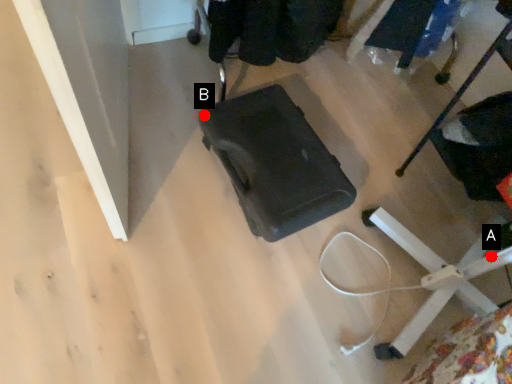
Question: Two points are circled on the image, labeled by A and B beside each circle. Which point is farther from the camera taking this photo?

Choices:
 (A) A is further
 (B) B is further

Answer: (B)